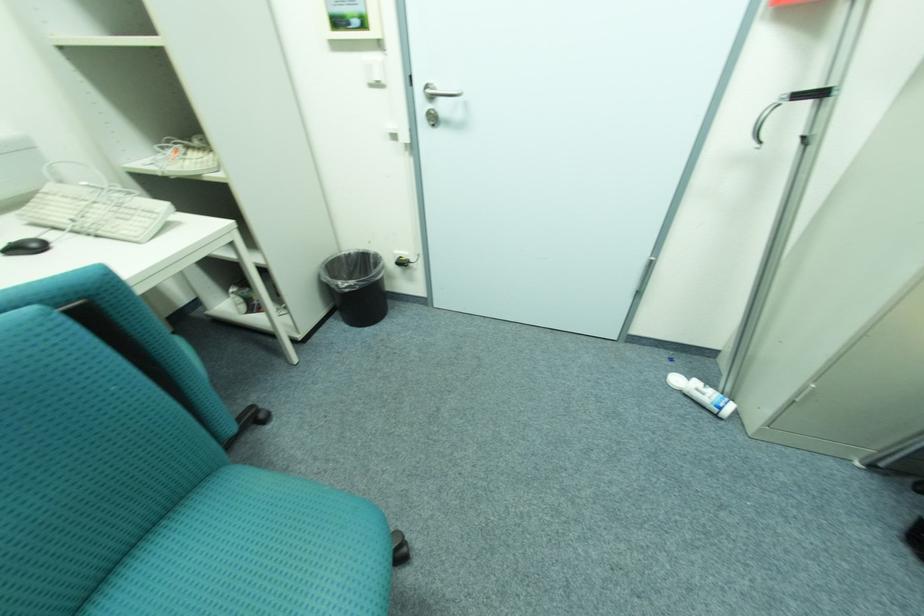
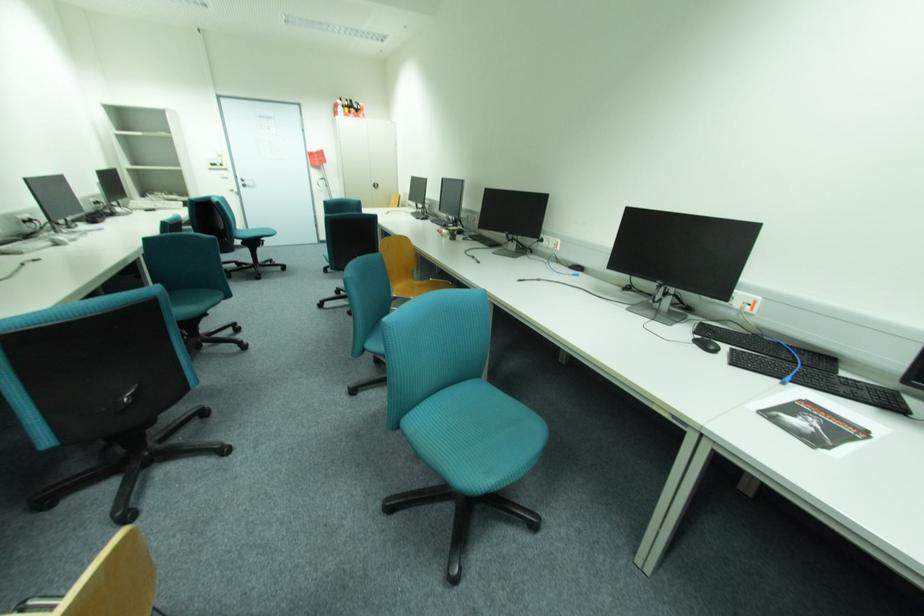
Question: I am providing you with two images of the same scene from different viewpoints. Which of the following objects are not visible in image2?

Choices:
 (A) silver door handle
 (B) black computer mouse
 (C) bottom drawer handle
 (D) white bottle

Answer: (D)